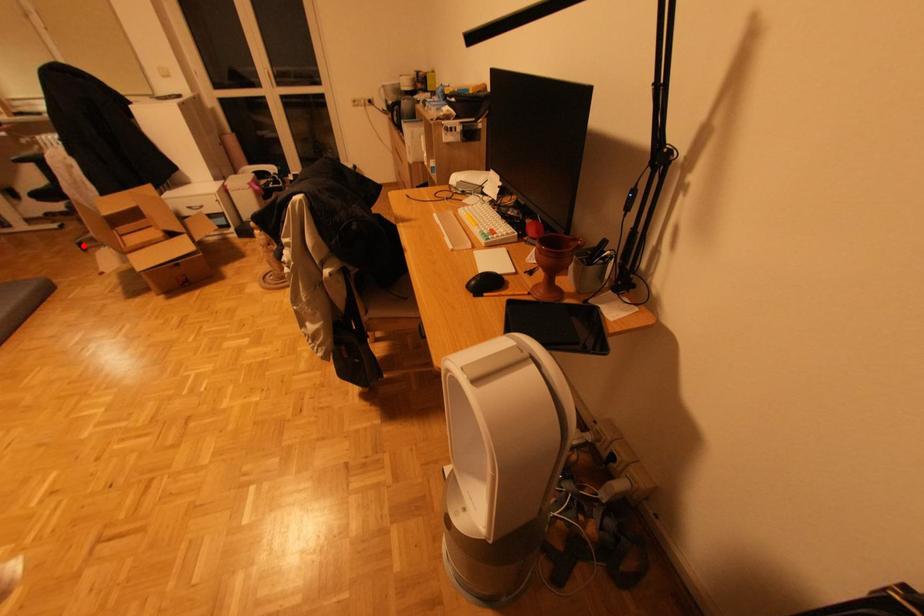
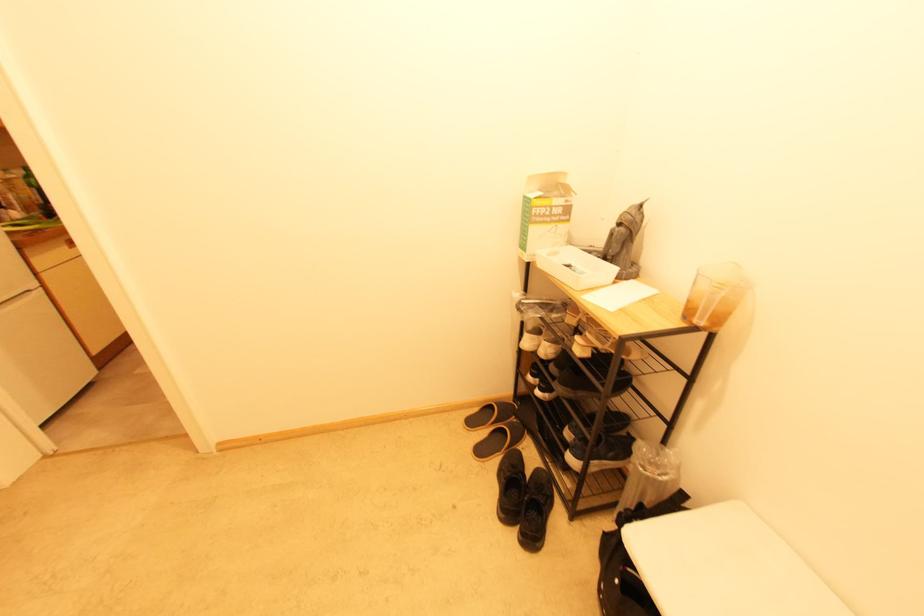
Question: I am providing you with two images of the same scene from different viewpoints. A red point is marked on the first image. At the location where the point appears in image 1, is it still visible in image 2?

Choices:
 (A) Yes
 (B) No

Answer: (B)